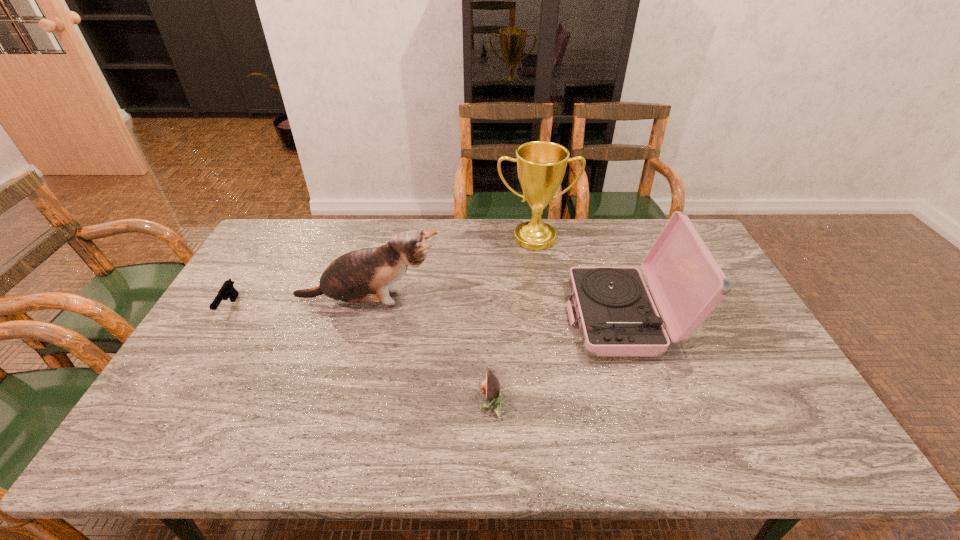
Identify the location of the tallest object. (541, 165).

Where is `the farthest object`? the farthest object is located at coordinates (541, 165).

This screenshot has width=960, height=540. Identify the location of record player. (617, 317).

The width and height of the screenshot is (960, 540). Identify the location of cat. point(351,277).

The image size is (960, 540). I want to click on the nearest object, so click(x=490, y=386).

Identify the location of the third object from left to right. Image resolution: width=960 pixels, height=540 pixels. (490, 386).

I want to click on the shortest object, so click(x=227, y=290).

The width and height of the screenshot is (960, 540). I want to click on pistol, so click(227, 290).

Locate an element on the screen. free space located 0.310m by the handles of the award is located at coordinates [546, 317].

The height and width of the screenshot is (540, 960). In order to click on vacant position located 0.370m with the lid open on the record player in this screenshot , I will do `click(443, 318)`.